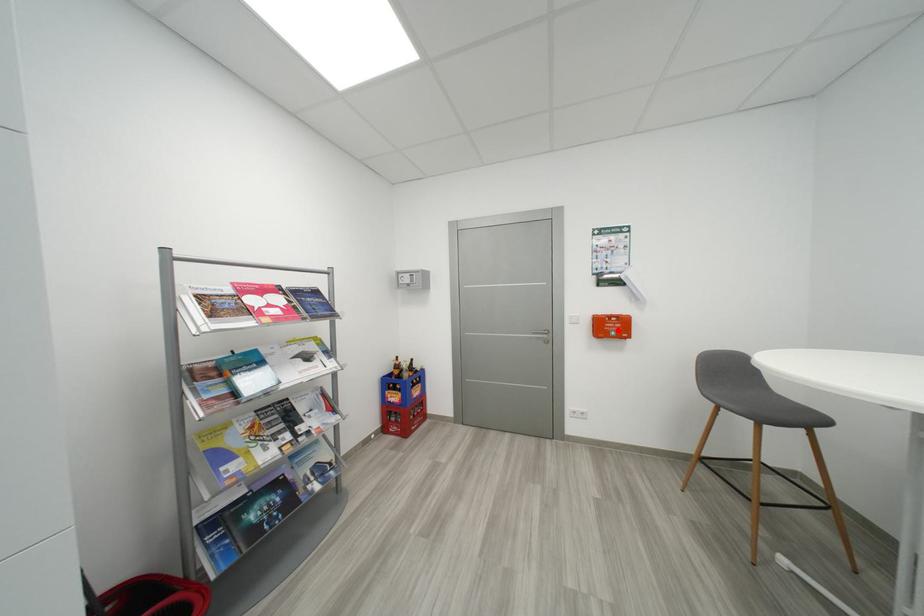
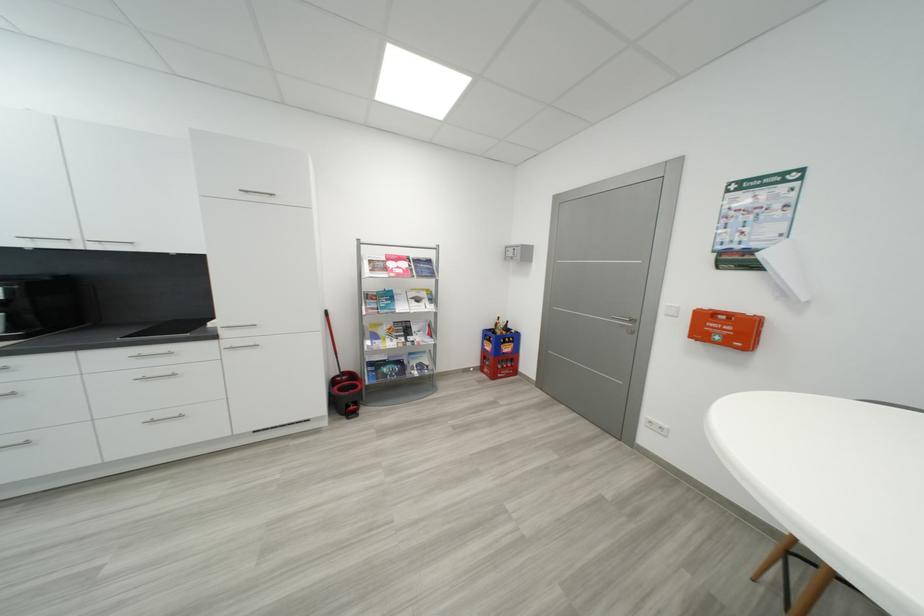
The point at the highlighted location is marked in the first image. Where is the corresponding point in the second image?

(733, 333)